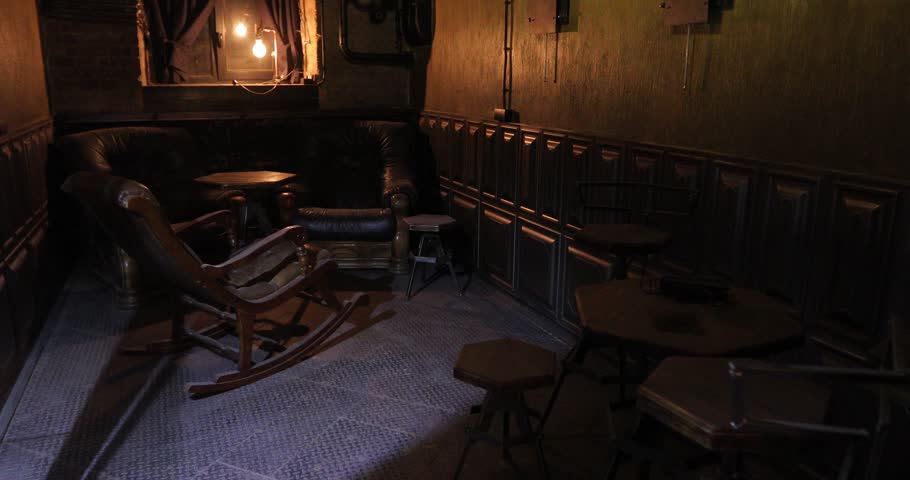
At what (x,y) coordinates should I click in order to perform the action: click on stool. Please return your answer as a coordinate pair (x, y). Image resolution: width=910 pixels, height=480 pixels. Looking at the image, I should click on (501, 367).